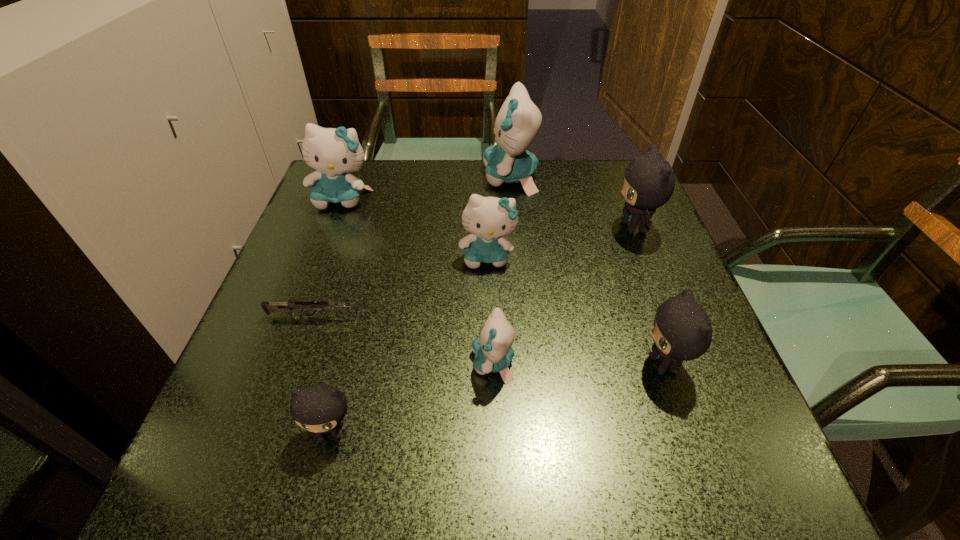
Locate an element on the screen. free space between the nearest object and the second farthest gray kitten is located at coordinates (497, 398).

You are a GUI agent. You are given a task and a screenshot of the screen. Output one action in this format:
    pyautogui.click(x=<x>, y=<y>)
    Task: Click on the vacant region between the shortest object and the tallest kitten
    
    Given the screenshot: What is the action you would take?
    pyautogui.click(x=412, y=247)

At what (x,y) coordinates should I click in order to perform the action: click on empty location between the tallest kitten and the smallest blue kitten. Please return your answer as a coordinate pair (x, y). This screenshot has width=960, height=540. Looking at the image, I should click on (502, 271).

Locate an element on the screen. blank region between the second biggest blue kitten and the nearest blue kitten is located at coordinates (418, 281).

Where is `vacant space that's between the third biggest blue kitten and the nearest blue kitten`? The width and height of the screenshot is (960, 540). vacant space that's between the third biggest blue kitten and the nearest blue kitten is located at coordinates (491, 310).

Locate an element on the screen. Image resolution: width=960 pixels, height=540 pixels. vacant point located between the second biggest gray kitten and the tallest object is located at coordinates (588, 271).

You are a GUI agent. You are given a task and a screenshot of the screen. Output one action in this format:
    pyautogui.click(x=<x>, y=<y>)
    Task: Click on the vacant space that's between the second nearest blue kitten and the smallest gray kitten
    This screenshot has height=540, width=960.
    Given the screenshot: What is the action you would take?
    pyautogui.click(x=409, y=345)

You are a GUI agent. You are given a task and a screenshot of the screen. Output one action in this format:
    pyautogui.click(x=<x>, y=<y>)
    Task: Click on the object that is the seventh closest to the shortest object
    Image resolution: width=960 pixels, height=540 pixels.
    Given the screenshot: What is the action you would take?
    (x=649, y=181)

Point out which object is positioned as the fifth nearest to the nearest blue kitten. Please provide its 2D coordinates. Your answer should be formatted as a tuple, i.e. [(x, y)], where the tuple contains the x and y coordinates of a point satisfying the conditions above.

[(649, 181)]

Locate an element on the screen. This screenshot has height=540, width=960. kitten that is the sixth closest to the biggest blue kitten is located at coordinates (320, 408).